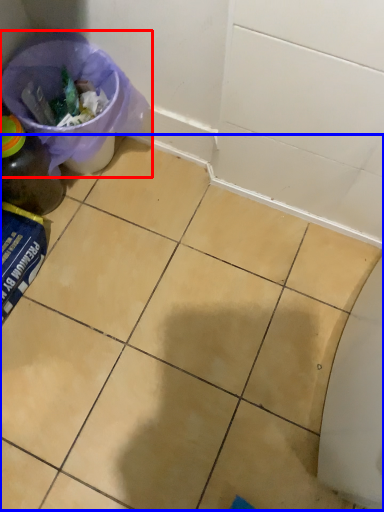
Question: Which of the following is the closest to the observer, recycling bin (highlighted by a red box) or ceramic tile (highlighted by a blue box)?

Choices:
 (A) recycling bin
 (B) ceramic tile

Answer: (B)